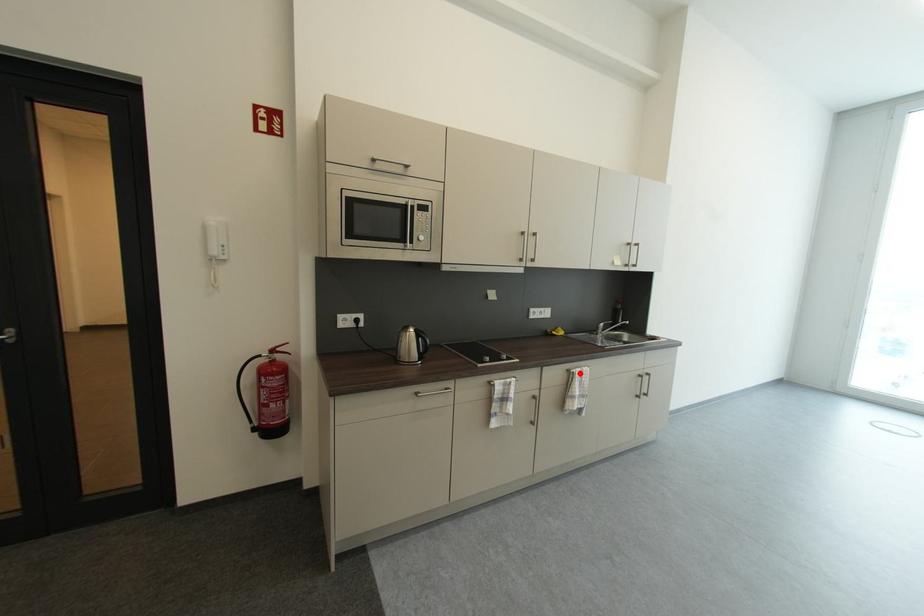
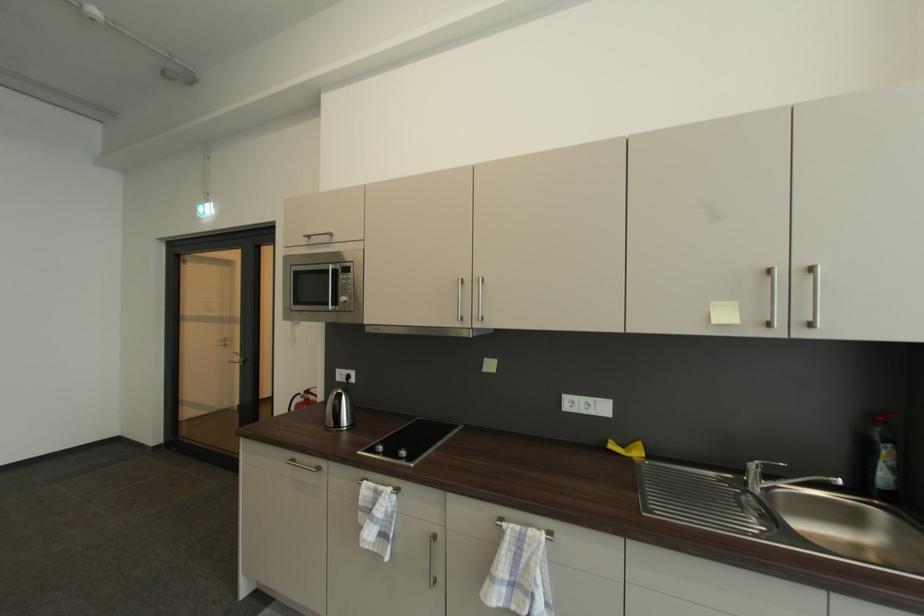
Where in the second image is the point corresponding to the highlighted location from the first image?

(507, 529)